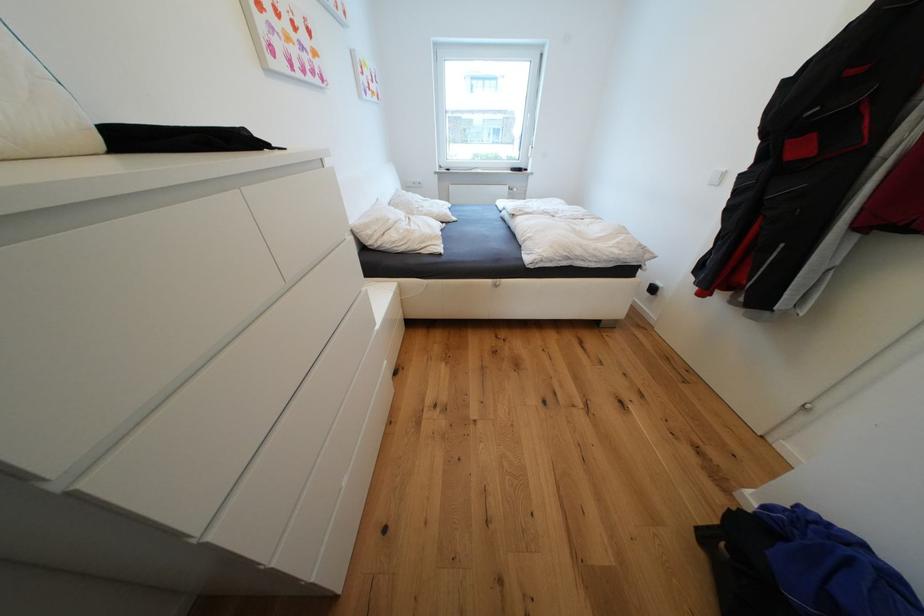
Describe the element at coordinates (568, 236) in the screenshot. I see `the white duvet` at that location.